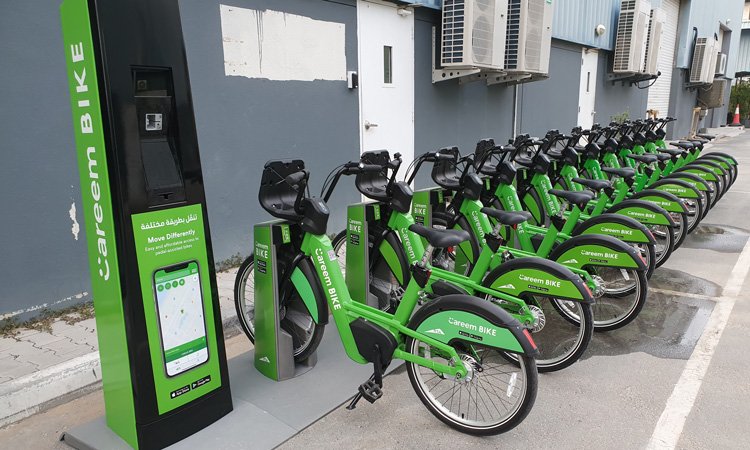
You are a GUI agent. You are given a task and a screenshot of the screen. Output one action in this format:
    pyautogui.click(x=<x>, y=<y>)
    Task: Click on the heating/cooling
    
    Given the screenshot: What is the action you would take?
    pyautogui.click(x=718, y=65), pyautogui.click(x=711, y=65), pyautogui.click(x=697, y=65), pyautogui.click(x=652, y=48), pyautogui.click(x=636, y=48), pyautogui.click(x=532, y=45), pyautogui.click(x=474, y=45)